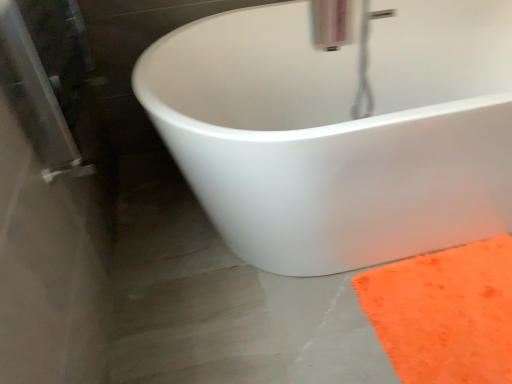
I want to click on metallic silver faucet at upper center, so click(x=331, y=23).

Image resolution: width=512 pixels, height=384 pixels. What do you see at coordinates (340, 132) in the screenshot?
I see `white matte bathtub at center` at bounding box center [340, 132].

Image resolution: width=512 pixels, height=384 pixels. What do you see at coordinates (445, 313) in the screenshot? I see `orange fuzzy rug at lower right` at bounding box center [445, 313].

Where is `metallic silver faucet at upper center`? This screenshot has width=512, height=384. metallic silver faucet at upper center is located at coordinates (331, 23).

Is metallic silver faucet at upper center located outside white matte bathtub at center?

Actually, metallic silver faucet at upper center is at least partially inside white matte bathtub at center.

Considering the sizes of metallic silver faucet at upper center and white matte bathtub at center in the image, is metallic silver faucet at upper center taller or shorter than white matte bathtub at center?

In the image, metallic silver faucet at upper center appears to be shorter than white matte bathtub at center.

Based on the photo, does metallic silver faucet at upper center have a lesser width compared to white matte bathtub at center?

Yes, metallic silver faucet at upper center is thinner than white matte bathtub at center.

From the image's perspective, is metallic silver faucet at upper center positioned above or below white matte bathtub at center?

Clearly, from the image's perspective, metallic silver faucet at upper center is above white matte bathtub at center.

Looking at this image, is white matte bathtub at center looking in the opposite direction of orange fuzzy rug at lower right?

That's not correct — white matte bathtub at center is not looking away from orange fuzzy rug at lower right.

Identify the location of doormat that appears on the right of white matte bathtub at center. tap(445, 313).

Is white matte bathtub at center in contact with orange fuzzy rug at lower right?

No, white matte bathtub at center is not with orange fuzzy rug at lower right.

Does orange fuzzy rug at lower right have a greater height compared to white matte bathtub at center?

No, orange fuzzy rug at lower right is not taller than white matte bathtub at center.

From the picture: Considering the sizes of orange fuzzy rug at lower right and white matte bathtub at center in the image, is orange fuzzy rug at lower right wider or thinner than white matte bathtub at center?

Considering their sizes, orange fuzzy rug at lower right looks slimmer than white matte bathtub at center.

How far apart are orange fuzzy rug at lower right and white matte bathtub at center?

15.62 inches.

Looking at this image, in the image, is orange fuzzy rug at lower right on the left side or the right side of white matte bathtub at center?

From the image, it's evident that orange fuzzy rug at lower right is to the right of white matte bathtub at center.

Can you confirm if orange fuzzy rug at lower right is smaller than metallic silver faucet at upper center?

Indeed, orange fuzzy rug at lower right has a smaller size compared to metallic silver faucet at upper center.

Can you confirm if orange fuzzy rug at lower right is taller than metallic silver faucet at upper center?

In fact, orange fuzzy rug at lower right may be shorter than metallic silver faucet at upper center.

Considering the points (472, 364) and (342, 41), which point is behind, point (472, 364) or point (342, 41)?

The point (342, 41) is farther from the camera.

Which object is further away from the camera taking this photo, orange fuzzy rug at lower right or metallic silver faucet at upper center?

metallic silver faucet at upper center is further from the camera.

From a real-world perspective, is metallic silver faucet at upper center above or below orange fuzzy rug at lower right?

metallic silver faucet at upper center is above orange fuzzy rug at lower right.

Does point (337, 42) come closer to viewer compared to point (465, 269)?

No, it is not.

Where is `doormat in front of the metallic silver faucet at upper center`? doormat in front of the metallic silver faucet at upper center is located at coordinates (445, 313).

Are metallic silver faucet at upper center and orange fuzzy rug at lower right making contact?

No, metallic silver faucet at upper center is not in contact with orange fuzzy rug at lower right.

Is white matte bathtub at center thinner than metallic silver faucet at upper center?

Incorrect, the width of white matte bathtub at center is not less than that of metallic silver faucet at upper center.

Considering the relative sizes of white matte bathtub at center and metallic silver faucet at upper center in the image provided, is white matte bathtub at center smaller than metallic silver faucet at upper center?

A: No, white matte bathtub at center is not smaller than metallic silver faucet at upper center.

Who is shorter, white matte bathtub at center or metallic silver faucet at upper center?

metallic silver faucet at upper center.

From the picture: Is white matte bathtub at center located outside metallic silver faucet at upper center?

Yes, white matte bathtub at center is outside of metallic silver faucet at upper center.

Locate an element on the screen. This screenshot has width=512, height=384. plumbing fixture behind the white matte bathtub at center is located at coordinates coord(331,23).

What are the coordinates of `doormat below the white matte bathtub at center (from a real-world perspective)` in the screenshot? It's located at [445, 313].

Estimate the real-world distances between objects in this image. Which object is closer to metallic silver faucet at upper center, orange fuzzy rug at lower right or white matte bathtub at center?

Based on the image, white matte bathtub at center appears to be nearer to metallic silver faucet at upper center.

From the image, which object appears to be farther from orange fuzzy rug at lower right, metallic silver faucet at upper center or white matte bathtub at center?

metallic silver faucet at upper center is further to orange fuzzy rug at lower right.

Based on their spatial positions, is white matte bathtub at center or orange fuzzy rug at lower right closer to metallic silver faucet at upper center?

Based on the image, white matte bathtub at center appears to be nearer to metallic silver faucet at upper center.

Estimate the real-world distances between objects in this image. Which object is closer to orange fuzzy rug at lower right, white matte bathtub at center or metallic silver faucet at upper center?

white matte bathtub at center is positioned closer to the anchor orange fuzzy rug at lower right.

Based on their spatial positions, is orange fuzzy rug at lower right or metallic silver faucet at upper center further from white matte bathtub at center?

metallic silver faucet at upper center is further to white matte bathtub at center.

From the image, which object appears to be farther from white matte bathtub at center, metallic silver faucet at upper center or orange fuzzy rug at lower right?

The object further to white matte bathtub at center is metallic silver faucet at upper center.

Locate an element on the screen. This screenshot has width=512, height=384. bathtub that lies between metallic silver faucet at upper center and orange fuzzy rug at lower right from top to bottom is located at coordinates (340, 132).